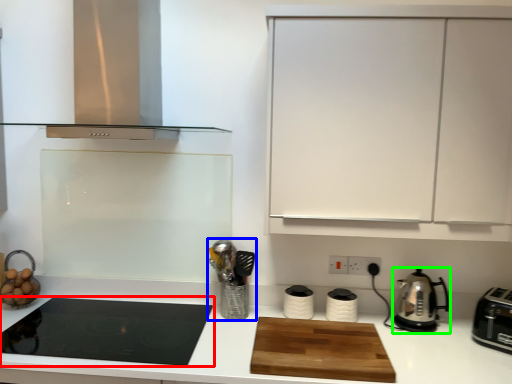
Question: Which object is positioned farthest from gas stove (highlighted by a red box)? Select from appliance (highlighted by a blue box) and kitchen appliance (highlighted by a green box).

Choices:
 (A) appliance
 (B) kitchen appliance

Answer: (B)